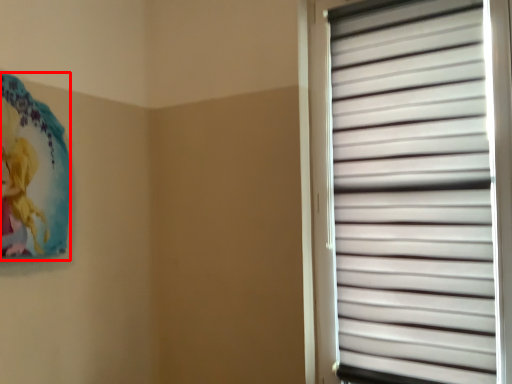
Question: In this image, where is art (annotated by the red box) located relative to window blind?

Choices:
 (A) right
 (B) left

Answer: (B)